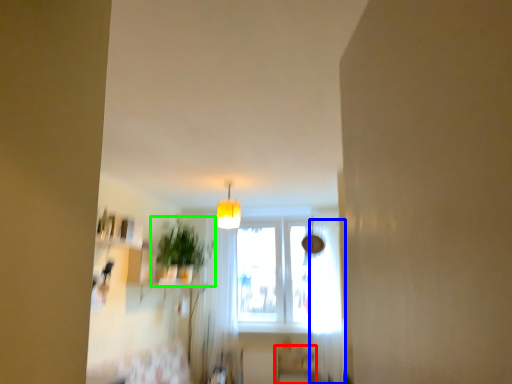
Question: Considering the real-world distances, which object is closest to furniture (highlighted by a red box)? curtain (highlighted by a blue box) or houseplant (highlighted by a green box).

Choices:
 (A) curtain
 (B) houseplant

Answer: (A)